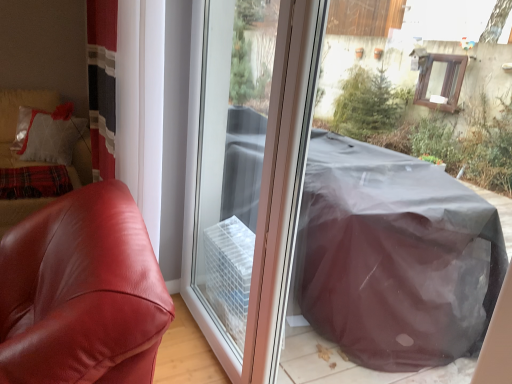
Question: Is satin red armchair at left taller than transparent plastic screen door at center?

Choices:
 (A) no
 (B) yes

Answer: (A)

Question: Would you consider satin red armchair at left to be distant from transparent plastic screen door at center?

Choices:
 (A) no
 (B) yes

Answer: (A)

Question: Is satin red armchair at left to the left of transparent plastic screen door at center from the viewer's perspective?

Choices:
 (A) no
 (B) yes

Answer: (B)

Question: Does satin red armchair at left come behind transparent plastic screen door at center?

Choices:
 (A) no
 (B) yes

Answer: (A)

Question: Does satin red armchair at left appear on the right side of transparent plastic screen door at center?

Choices:
 (A) yes
 (B) no

Answer: (B)

Question: Can you confirm if satin red armchair at left is bigger than transparent plastic screen door at center?

Choices:
 (A) yes
 (B) no

Answer: (A)

Question: Is satin red armchair at left not close to matte leather couch at left?

Choices:
 (A) no
 (B) yes

Answer: (B)

Question: Is matte leather couch at left at the back of satin red armchair at left?

Choices:
 (A) no
 (B) yes

Answer: (A)

Question: Considering the relative sizes of satin red armchair at left and matte leather couch at left in the image provided, is satin red armchair at left bigger than matte leather couch at left?

Choices:
 (A) no
 (B) yes

Answer: (A)

Question: From a real-world perspective, is satin red armchair at left positioned over matte leather couch at left based on gravity?

Choices:
 (A) no
 (B) yes

Answer: (A)

Question: Is satin red armchair at left to the left of matte leather couch at left from the viewer's perspective?

Choices:
 (A) yes
 (B) no

Answer: (B)

Question: Is satin red armchair at left next to matte leather couch at left and touching it?

Choices:
 (A) no
 (B) yes

Answer: (A)

Question: Can you confirm if matte leather couch at left is positioned to the left of satin red armchair at left?

Choices:
 (A) no
 (B) yes

Answer: (B)